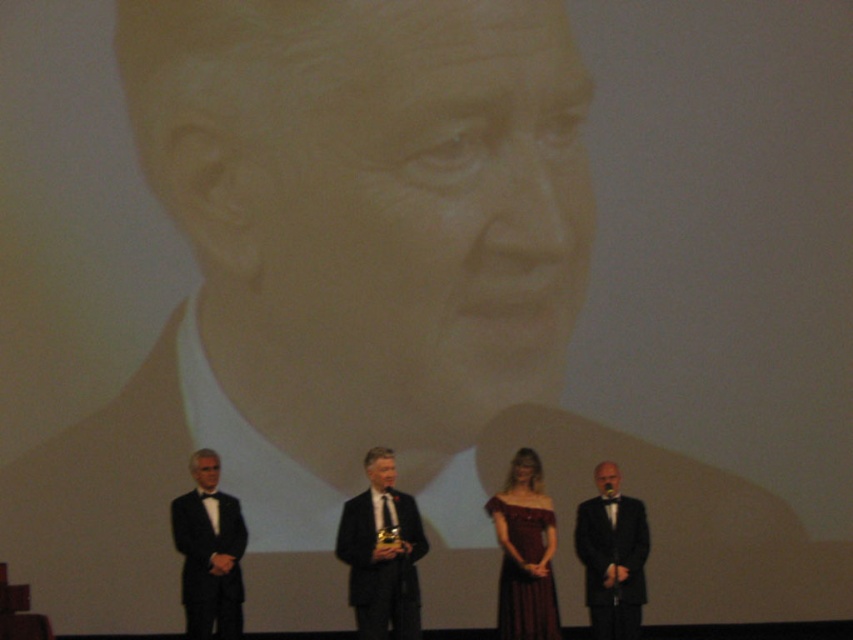
How distant is velvet burgundy dress at center from black satin suit at lower right?

velvet burgundy dress at center and black satin suit at lower right are 24.07 inches apart.

Identify the location of velvet burgundy dress at center. Image resolution: width=853 pixels, height=640 pixels. (525, 552).

Where is `velvet burgundy dress at center`? Image resolution: width=853 pixels, height=640 pixels. velvet burgundy dress at center is located at coordinates (525, 552).

Which is more to the right, black satin suit at left or black satin suit at lower right?

From the viewer's perspective, black satin suit at lower right appears more on the right side.

Between point (215, 572) and point (606, 588), which one is positioned behind?

The point (606, 588) is behind.

Identify the location of black satin suit at left. This screenshot has height=640, width=853. (209, 552).

How distant is black satin suit at left from velvet burgundy dress at center?

A distance of 8.93 feet exists between black satin suit at left and velvet burgundy dress at center.

Is black satin suit at left smaller than velvet burgundy dress at center?

Incorrect, black satin suit at left is not smaller in size than velvet burgundy dress at center.

Does point (192, 461) lie in front of point (537, 560)?

No, (192, 461) is further to viewer.

Where is `black satin suit at left`? The image size is (853, 640). black satin suit at left is located at coordinates (209, 552).